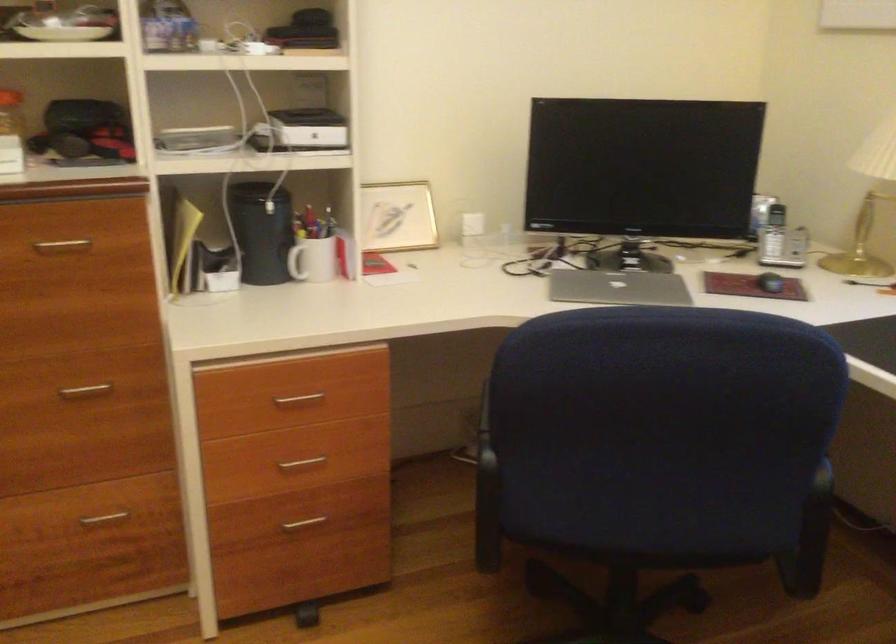
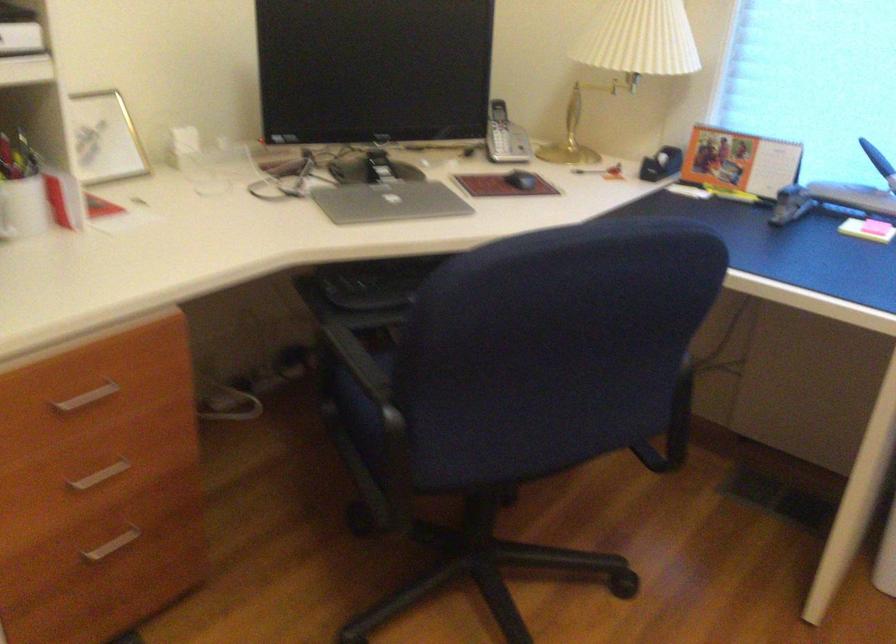
In the second image, find the point that corresponds to point (495, 422) in the first image.

(365, 375)